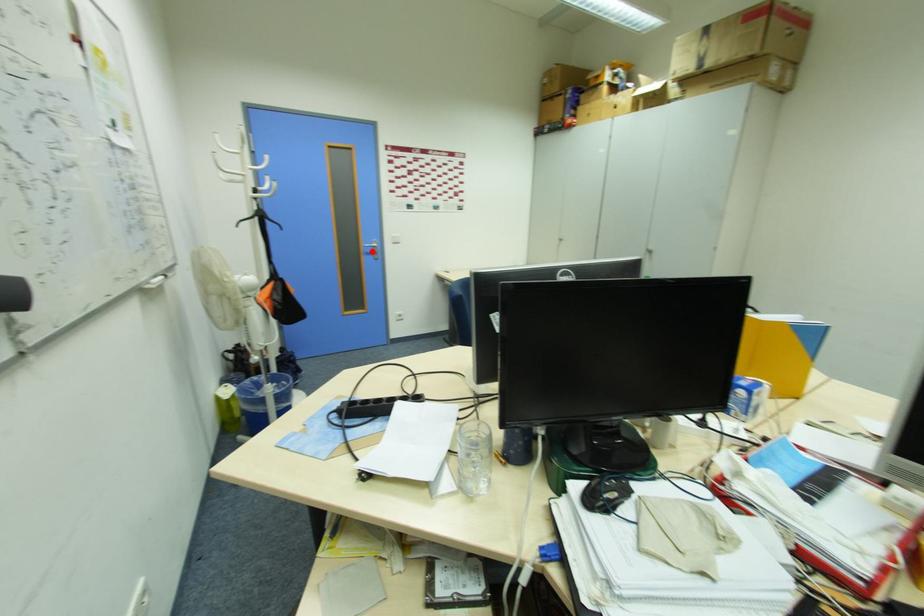
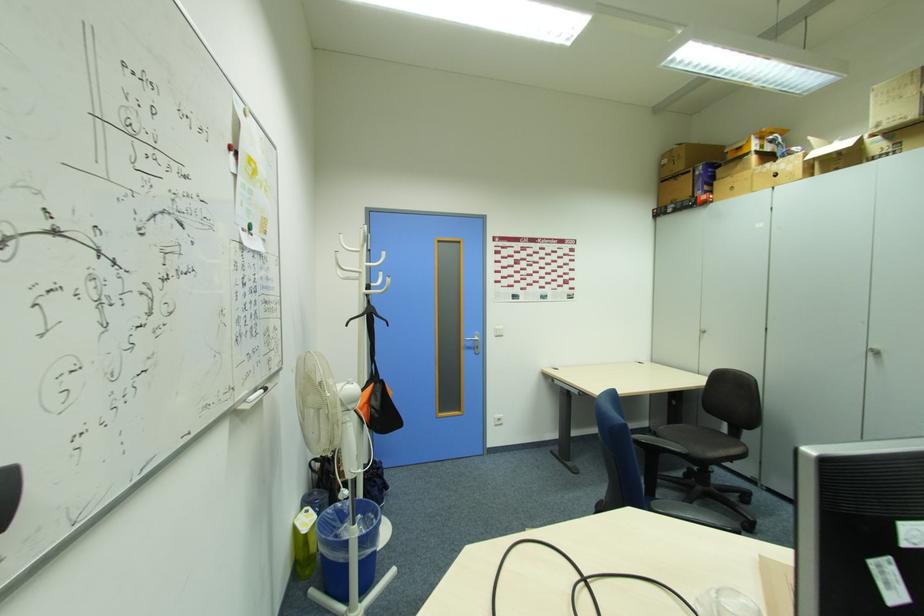
Question: I am providing you with two images of the same scene from different viewpoints. Image1 has a red point marked. In image2, the corresponding 3D location appears at what relative position? Reply with the corresponding letter.

Choices:
 (A) Closer
 (B) Farther

Answer: (B)